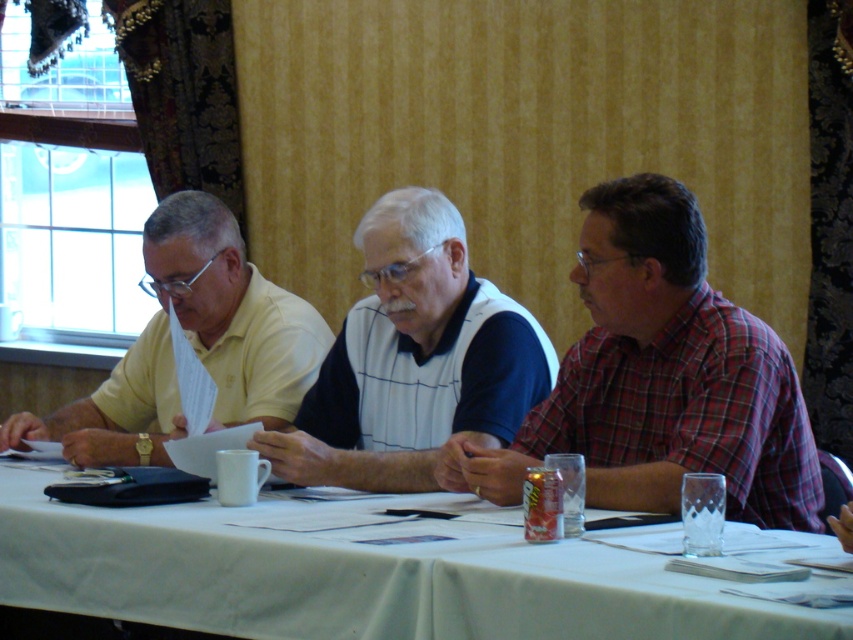
You are a photographer trying to capture a group photo of the red plaid shirt at right and the white textured polo shirt at center. Based on their positions, which person should you position closer to the camera to ensure both are in focus?

The red plaid shirt at right is located below the white textured polo shirt at center, so you should position the white textured polo shirt at center closer to the camera to ensure both are in focus.

You are a photographer trying to capture a group photo of the red plaid shirt at right and the white textured polo shirt at center. Which person should you position closer to the camera to ensure both appear equally sized in the photo?

You should position the white textured polo shirt at center closer to the camera because the red plaid shirt at right is wider in real life. This adjustment will make both appear the same size in the photo.

Consider the image. You are a photographer standing behind the table where the white textured polo shirt at center and the yellow matte shirt at left are sitting. You want to take a photo of both shirts clearly. The camera you are using has a maximum focus range of 15 inches. Can you capture both shirts in focus without moving the camera or the shirts?

The distance between the white textured polo shirt at center and the yellow matte shirt at left is 18.07 inches, which exceeds the camera maximum focus range of 15 inches. Therefore, you cannot capture both shirts in focus without adjusting the camera or moving the shirts.